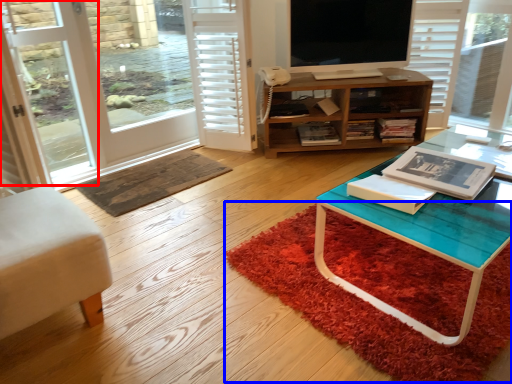
Question: Among these objects, which one is nearest to the camera, screen door (highlighted by a red box) or doormat (highlighted by a blue box)?

Choices:
 (A) screen door
 (B) doormat

Answer: (B)